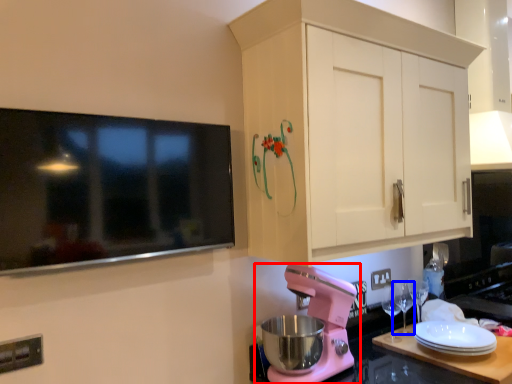
Question: Which object appears farthest to the camera in this image, mixer (highlighted by a red box) or wine glass (highlighted by a blue box)?

Choices:
 (A) mixer
 (B) wine glass

Answer: (B)